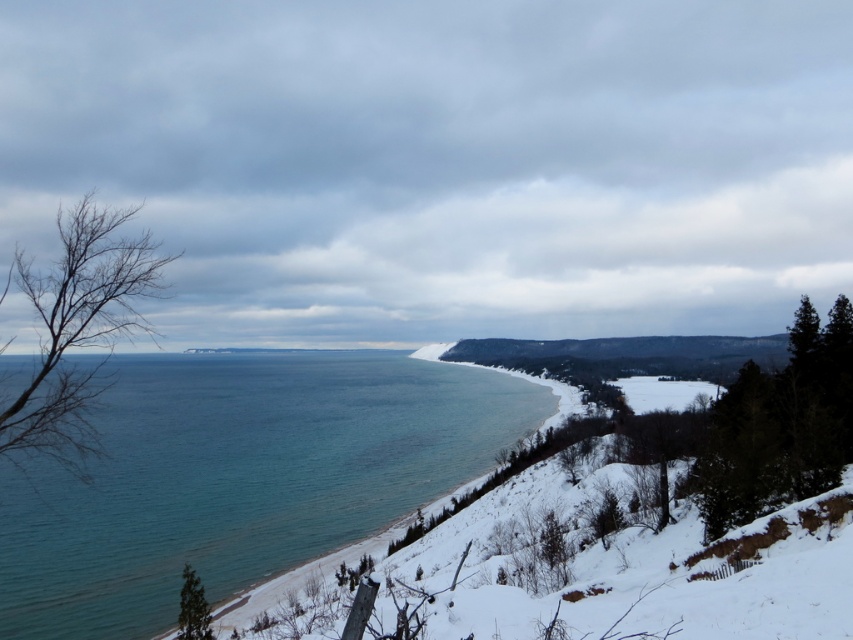
Does clear blue water at center appear on the right side of green matte tree at lower left?

No, clear blue water at center is not to the right of green matte tree at lower left.

Is point (463, 451) more distant than point (194, 573)?

That is True.

The height and width of the screenshot is (640, 853). What are the coordinates of `clear blue water at center` in the screenshot? It's located at (238, 477).

Is clear blue water at center in front of dark green evergreen at right?

Yes, clear blue water at center is in front of dark green evergreen at right.

Which is above, clear blue water at center or dark green evergreen at right?

dark green evergreen at right

Image resolution: width=853 pixels, height=640 pixels. I want to click on clear blue water at center, so click(x=238, y=477).

Measure the distance between point (x=149, y=324) and camera.

Point (x=149, y=324) is 31.80 meters away from camera.

Is bare branches at left positioned at the back of dark green evergreen at right?

No, it is not.

At what (x,y) coordinates should I click in order to perform the action: click on bare branches at left. Please return your answer as a coordinate pair (x, y). Looking at the image, I should click on (74, 332).